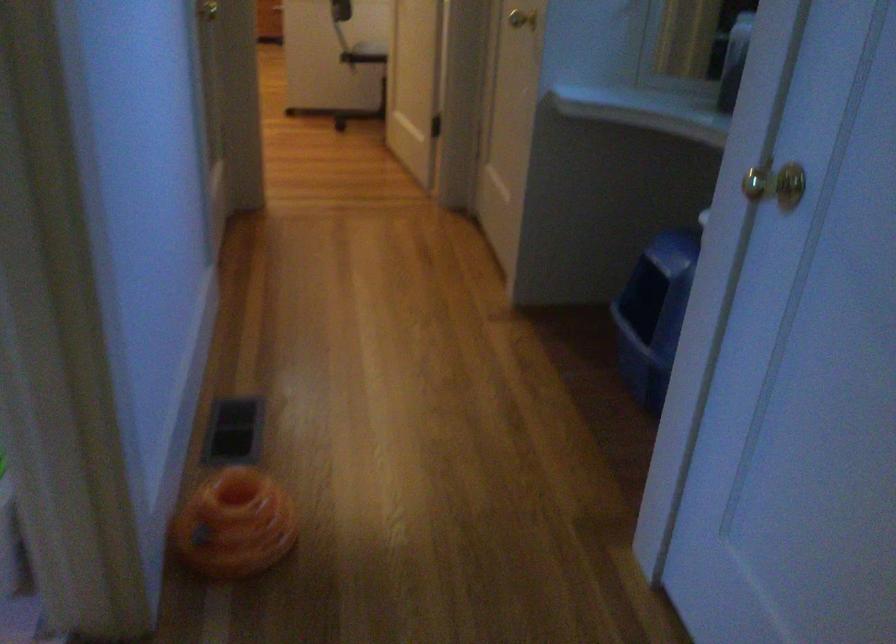
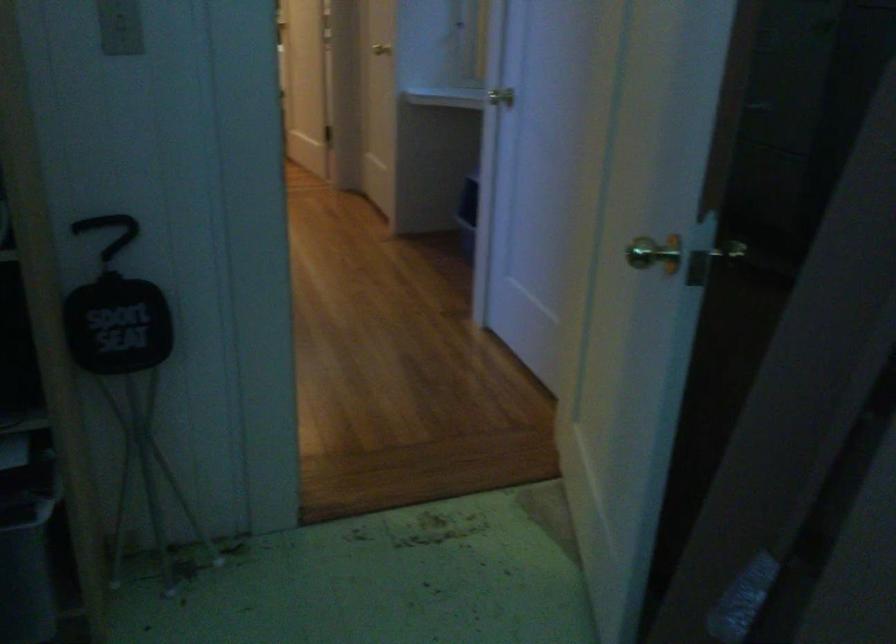
Question: I am providing you with two images of the same scene from different viewpoints. Please identify which objects are invisible in image2.

Choices:
 (A) brass door handle
 (B) fan control button
 (C) light switch
 (D) chair sitting surface

Answer: (D)